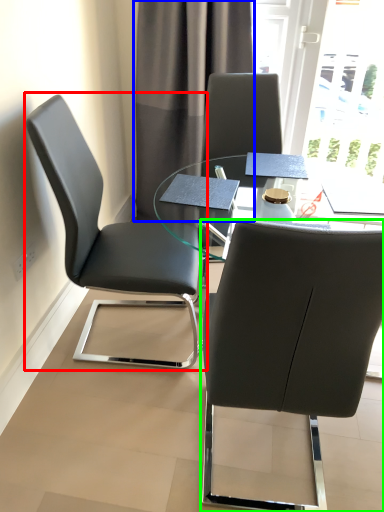
Question: Which is nearer to the chair (highlighted by a red box)? curtain (highlighted by a blue box) or chair (highlighted by a green box).

Choices:
 (A) curtain
 (B) chair

Answer: (B)